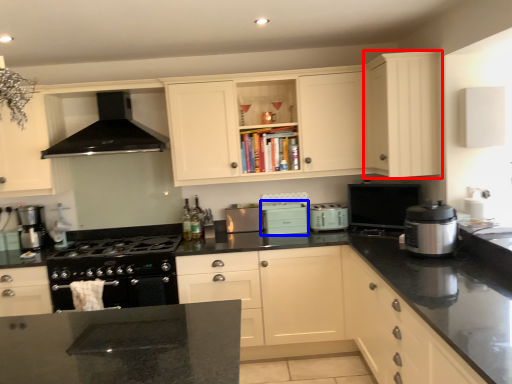
Question: Which object is closer to the camera taking this photo, cabinetry (highlighted by a red box) or appliance (highlighted by a blue box)?

Choices:
 (A) cabinetry
 (B) appliance

Answer: (A)